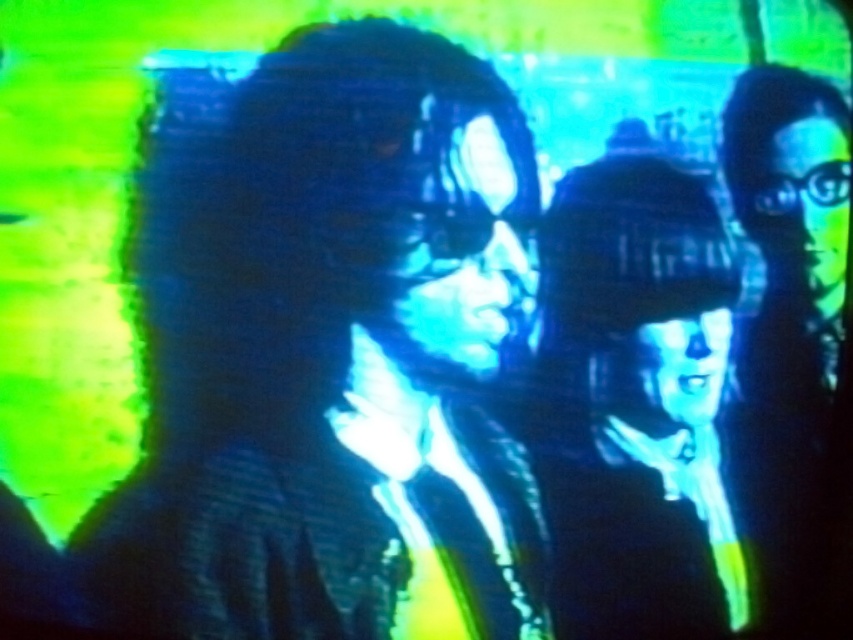
You are a game developer analyzing a VR headset placement in a distorted image. The scene shows a group of people with their hands raised. Where is the matte black vr headset at center located in terms of coordinates?

The matte black vr headset at center is located at coordinates point (635, 404).

Looking at this image, you are a virtual reality technician inspecting a distorted image of a group of people. You notice a point labeled at coordinates point (635, 404). What object is located at that point?

The point (635, 404) marks the location of the matte black vr headset at center.